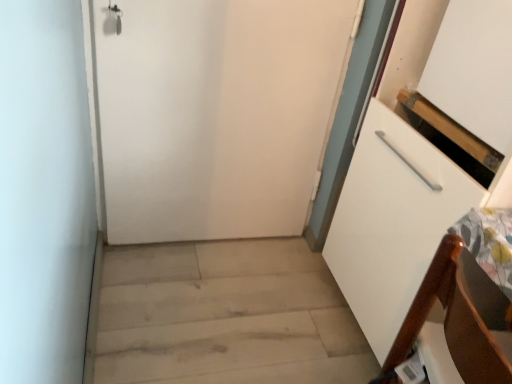
What do you see at coordinates (453, 326) in the screenshot? The width and height of the screenshot is (512, 384). I see `brown wood chair at lower right` at bounding box center [453, 326].

This screenshot has height=384, width=512. Identify the location of light wood floor at lower left. (226, 316).

From a real-world perspective, which is physically below, white matte door at center or light wood floor at lower left?

light wood floor at lower left.

Considering the relative sizes of white matte door at center and light wood floor at lower left in the image provided, is white matte door at center taller than light wood floor at lower left?

Indeed, white matte door at center has a greater height compared to light wood floor at lower left.

Is white matte door at center to the left or to the right of light wood floor at lower left in the image?

white matte door at center is positioned on light wood floor at lower left's left side.

From the image's perspective, is white matte door at center beneath light wood floor at lower left?

No, from the image's perspective, white matte door at center is not below light wood floor at lower left.

From a real-world perspective, is light wood floor at lower left positioned under brown wood chair at lower right based on gravity?

Yes, from a real-world perspective, light wood floor at lower left is beneath brown wood chair at lower right.

How different are the orientations of light wood floor at lower left and brown wood chair at lower right in degrees?

170 degrees.

Considering the relative sizes of light wood floor at lower left and brown wood chair at lower right in the image provided, is light wood floor at lower left thinner than brown wood chair at lower right?

No, light wood floor at lower left is not thinner than brown wood chair at lower right.

Locate an element on the screen. Image resolution: width=512 pixels, height=384 pixels. door that appears above the brown wood chair at lower right (from the image's perspective) is located at coordinates (215, 114).

Can you confirm if white matte door at center is smaller than brown wood chair at lower right?

Incorrect, white matte door at center is not smaller in size than brown wood chair at lower right.

Is point (115, 82) closer or farther from the camera than point (410, 322)?

Clearly, point (115, 82) is more distant from the camera than point (410, 322).

Measure the distance from white matte door at center to brown wood chair at lower right.

white matte door at center is 3.39 feet away from brown wood chair at lower right.

How distant is brown wood chair at lower right from white matte door at center?

The distance of brown wood chair at lower right from white matte door at center is 1.03 meters.

Between point (413, 338) and point (223, 93), which one is positioned behind?

The point (223, 93) is behind.

Considering the relative sizes of brown wood chair at lower right and white matte door at center in the image provided, is brown wood chair at lower right wider than white matte door at center?

Correct, the width of brown wood chair at lower right exceeds that of white matte door at center.

Which object is positioned more to the right, brown wood chair at lower right or white matte door at center?

brown wood chair at lower right is more to the right.

In terms of width, does brown wood chair at lower right look wider or thinner when compared to light wood floor at lower left?

In the image, brown wood chair at lower right appears to be more narrow than light wood floor at lower left.

From the image's perspective, is brown wood chair at lower right on light wood floor at lower left?

Correct, brown wood chair at lower right appears higher than light wood floor at lower left in the image.

From a real-world perspective, is brown wood chair at lower right positioned under light wood floor at lower left based on gravity?

No, from a real-world perspective, brown wood chair at lower right is not beneath light wood floor at lower left.

Looking at this image, how different are the orientations of brown wood chair at lower right and light wood floor at lower left in degrees?

170 degrees separate the facing orientations of brown wood chair at lower right and light wood floor at lower left.

From the image's perspective, is light wood floor at lower left on white matte door at center?

Actually, light wood floor at lower left appears below white matte door at center in the image.

Is light wood floor at lower left positioned with its back to white matte door at center?

light wood floor at lower left does not have its back to white matte door at center.

Is point (287, 300) positioned after point (323, 136)?

No, (287, 300) is in front of (323, 136).

How many degrees apart are the facing directions of light wood floor at lower left and white matte door at center?

There is a 89.7-degree angle between the facing directions of light wood floor at lower left and white matte door at center.

The image size is (512, 384). I want to click on stairwell in front of the white matte door at center, so [x=226, y=316].

The height and width of the screenshot is (384, 512). Identify the location of furniture positioned vertically above the light wood floor at lower left (from a real-world perspective). (453, 326).

Consider the image. From the image, which object appears to be farther from white matte door at center, brown wood chair at lower right or light wood floor at lower left?

brown wood chair at lower right is positioned further to the anchor white matte door at center.

From the image, which object appears to be nearer to white matte door at center, light wood floor at lower left or brown wood chair at lower right?

Among the two, light wood floor at lower left is located nearer to white matte door at center.

Looking at the image, which one is located closer to brown wood chair at lower right, light wood floor at lower left or white matte door at center?

light wood floor at lower left lies closer to brown wood chair at lower right than the other object.

Considering their positions, is white matte door at center positioned further to light wood floor at lower left than brown wood chair at lower right?

brown wood chair at lower right lies further to light wood floor at lower left than the other object.

Consider the image. Which object lies further to the anchor point brown wood chair at lower right, white matte door at center or light wood floor at lower left?

Among the two, white matte door at center is located further to brown wood chair at lower right.

From the image, which object appears to be nearer to light wood floor at lower left, brown wood chair at lower right or white matte door at center?

Among the two, white matte door at center is located nearer to light wood floor at lower left.

I want to click on furniture between white matte door at center and light wood floor at lower left in the up-down direction, so click(453, 326).